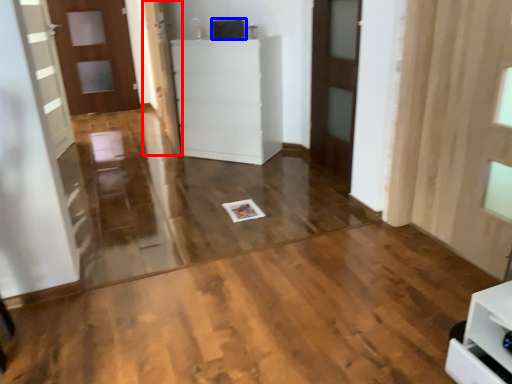
Question: Among these objects, which one is nearest to the camera, door (highlighted by a red box) or appliance (highlighted by a blue box)?

Choices:
 (A) door
 (B) appliance

Answer: (A)